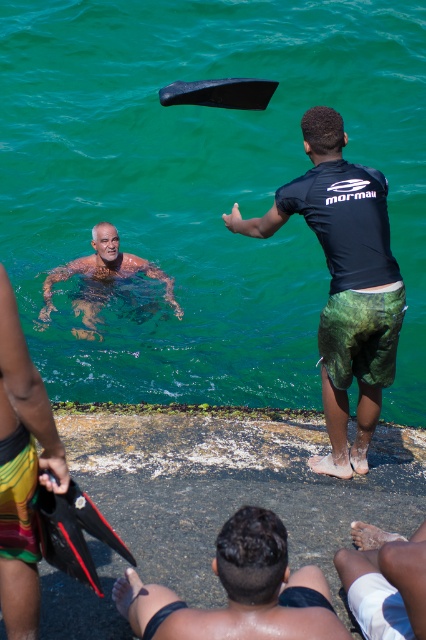
You are a lifeguard on duty and notice two objects in the water. The green water at upper center and the black matte wetsuit at center. Which object is wider?

The green water at upper center is wider than the black matte wetsuit at center according to the description provided.

You are a photographer trying to capture a candid shot of the dark brown skin at lower center. Based on its position at coordinates point 0.925, 0.556, where would you aim your camera to ensure it is centered in the frame?

The dark brown skin at lower center is located at point (236, 592), so you should aim your camera directly at that coordinate to center it in the frame.